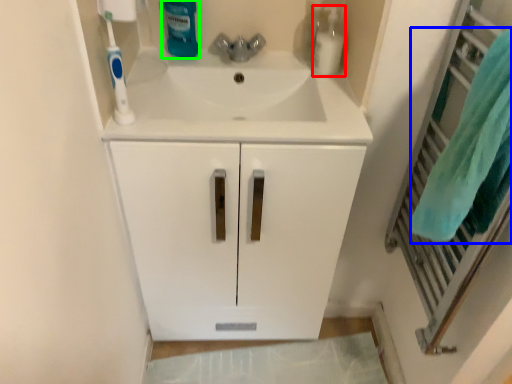
Question: Considering the real-world distances, which object is farthest from cleaning product (highlighted by a red box)? bath towel (highlighted by a blue box) or cleaning product (highlighted by a green box)?

Choices:
 (A) bath towel
 (B) cleaning product

Answer: (A)